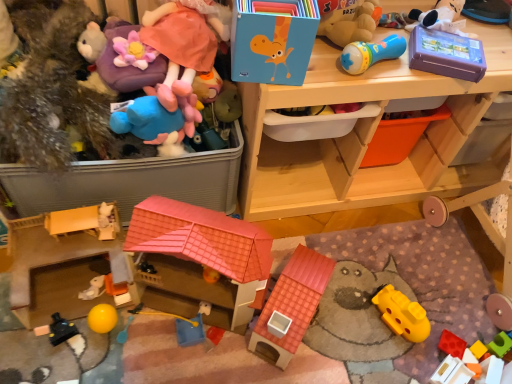
This screenshot has width=512, height=384. In order to click on free space in front of white plush toy at lower left, the third toy positioned from the left in this screenshot , I will do `click(68, 354)`.